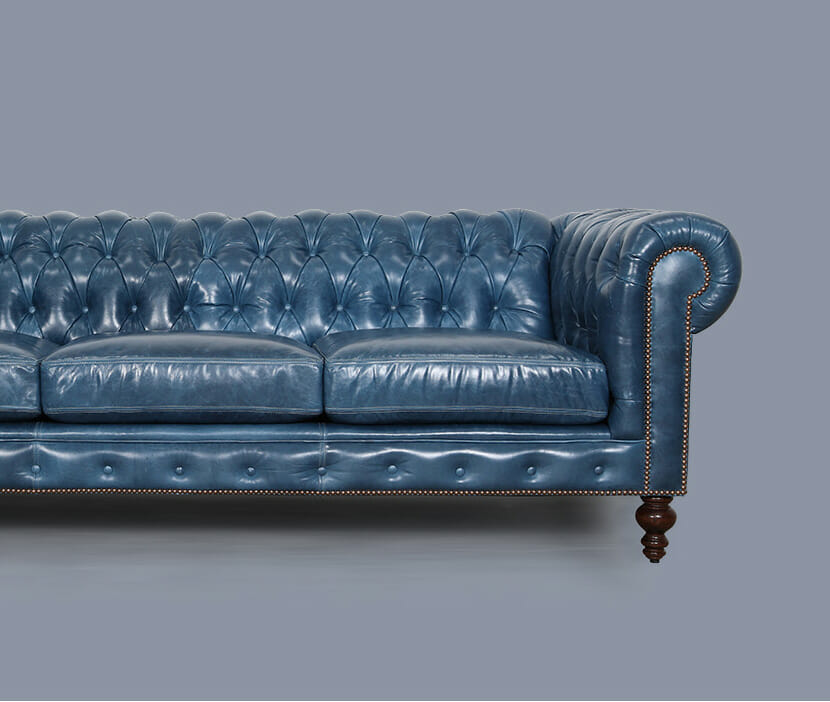
Image resolution: width=830 pixels, height=702 pixels. What are the coordinates of `shadow under cushion` in the screenshot? It's located at (417, 420), (319, 420).